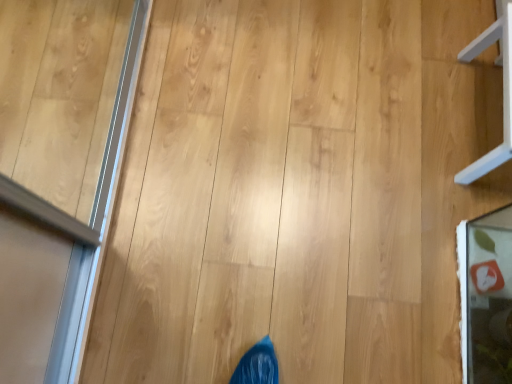
You are a GUI agent. You are given a task and a screenshot of the screen. Output one action in this format:
    pyautogui.click(x=<x>, y=<y>)
    Task: Click on the free spot in front of white matte chair at right
    This screenshot has width=512, height=384.
    Given the screenshot: What is the action you would take?
    pyautogui.click(x=453, y=217)